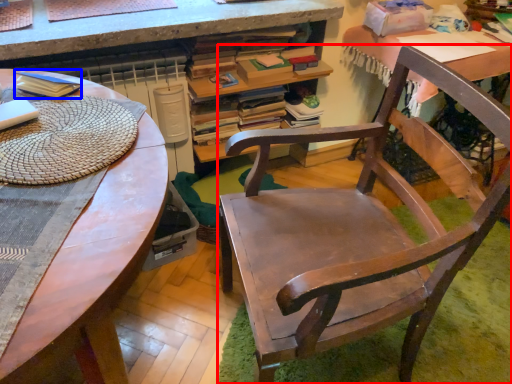
Question: Which object appears farthest to the camera in this image, chair (highlighted by a red box) or paperback book (highlighted by a blue box)?

Choices:
 (A) chair
 (B) paperback book

Answer: (B)